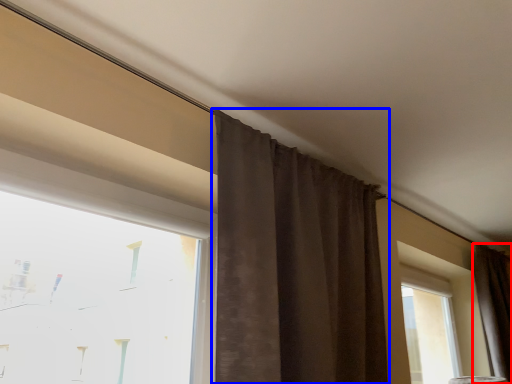
Question: Which point is further to the camera, curtain (highlighted by a red box) or curtain (highlighted by a blue box)?

Choices:
 (A) curtain
 (B) curtain

Answer: (A)